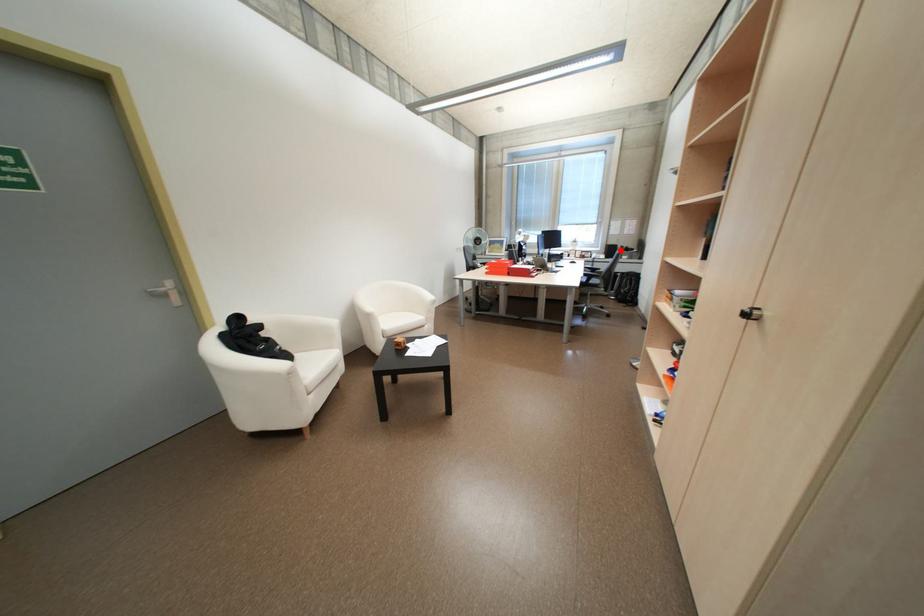
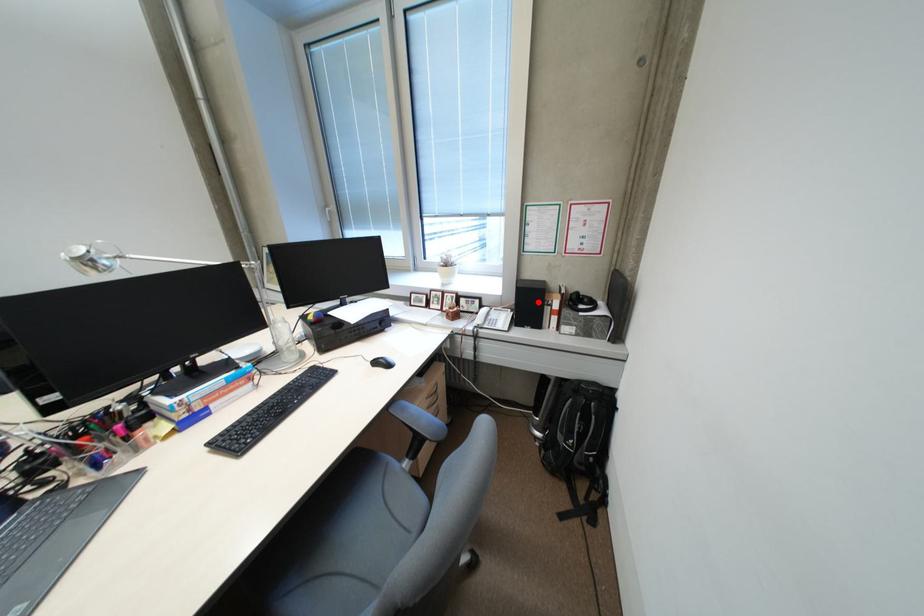
I am providing you with two images of the same scene from different viewpoints. A red point is marked on the first image and another point is marked on the second image. Does the point marked in image1 correspond to the same location as the one in image2?

Yes